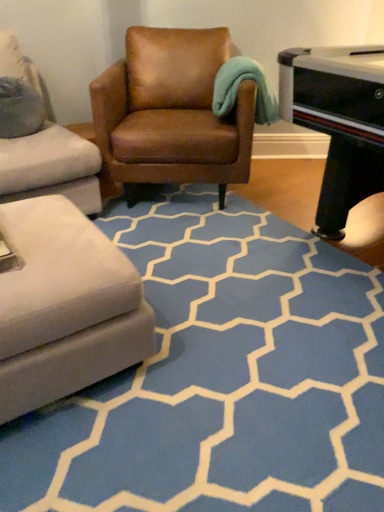
What do you see at coordinates (221, 377) in the screenshot? I see `blue carpet at center` at bounding box center [221, 377].

Where is `blue carpet at center`? blue carpet at center is located at coordinates (221, 377).

Measure the distance between point (177, 329) and camera.

1.50 meters.

Find the location of a particular element. This screenshot has width=384, height=512. brown leather chair at center is located at coordinates (171, 113).

The width and height of the screenshot is (384, 512). What do you see at coordinates (171, 113) in the screenshot? I see `brown leather chair at center` at bounding box center [171, 113].

What is the approximate height of brown leather chair at center?

brown leather chair at center is 33.47 inches in height.

Image resolution: width=384 pixels, height=512 pixels. What are the coordinates of `blue carpet at center` in the screenshot? It's located at (221, 377).

Looking at this image, which object is positioned more to the right, blue carpet at center or brown leather chair at center?

blue carpet at center.

Is the position of blue carpet at center less distant than that of brown leather chair at center?

Yes, blue carpet at center is in front of brown leather chair at center.

Considering the positions of point (136, 461) and point (229, 133), is point (136, 461) closer or farther from the camera than point (229, 133)?

Clearly, point (136, 461) is closer to the camera than point (229, 133).

From the image's perspective, would you say blue carpet at center is positioned over brown leather chair at center?

No, from the image's perspective, blue carpet at center is not on top of brown leather chair at center.

From a real-world perspective, is blue carpet at center below brown leather chair at center?

Yes, from a real-world perspective, blue carpet at center is under brown leather chair at center.

Does blue carpet at center have a greater width compared to brown leather chair at center?

Yes.

Is blue carpet at center taller than brown leather chair at center?

In fact, blue carpet at center may be shorter than brown leather chair at center.

Which of these two, blue carpet at center or brown leather chair at center, is smaller?

Smaller between the two is blue carpet at center.

Do you think blue carpet at center is within brown leather chair at center, or outside of it?

blue carpet at center cannot be found inside brown leather chair at center.

Is the surface of blue carpet at center in direct contact with brown leather chair at center?

No, blue carpet at center is not beside brown leather chair at center.

Consider the image. Is blue carpet at center looking in the opposite direction of brown leather chair at center?

No, blue carpet at center is not facing away from brown leather chair at center.

You are a GUI agent. You are given a task and a screenshot of the screen. Output one action in this format:
    pyautogui.click(x=<x>, y=<y>)
    Task: Click on the chair that is on the left side of blue carpet at center
    
    Given the screenshot: What is the action you would take?
    pyautogui.click(x=171, y=113)

Is brown leather chair at center to the left or to the right of blue carpet at center in the image?

From the image, it's evident that brown leather chair at center is to the left of blue carpet at center.

From the picture: Is the depth of brown leather chair at center less than that of blue carpet at center?

No, the depth of brown leather chair at center is greater than that of blue carpet at center.

Between point (115, 116) and point (44, 423), which one is positioned behind?

The point (115, 116) is farther.

From the image's perspective, between brown leather chair at center and blue carpet at center, which one is located above?

brown leather chair at center.

Consider the image. From a real-world perspective, which object stands above the other?

brown leather chair at center.

Looking at this image, considering the sizes of objects brown leather chair at center and blue carpet at center in the image provided, who is wider, brown leather chair at center or blue carpet at center?

With larger width is blue carpet at center.

Can you confirm if brown leather chair at center is taller than blue carpet at center?

Yes.

Considering the sizes of objects brown leather chair at center and blue carpet at center in the image provided, who is bigger, brown leather chair at center or blue carpet at center?

With larger size is brown leather chair at center.

Is brown leather chair at center not inside blue carpet at center?

Yes, brown leather chair at center is outside of blue carpet at center.

Are brown leather chair at center and blue carpet at center beside each other?

No.

Is brown leather chair at center aimed at blue carpet at center?

Yes, brown leather chair at center faces towards blue carpet at center.

What's the angular difference between brown leather chair at center and blue carpet at center's facing directions?

146 degrees separate the facing orientations of brown leather chair at center and blue carpet at center.

Measure the distance from brown leather chair at center to blue carpet at center.

A distance of 38.20 inches exists between brown leather chair at center and blue carpet at center.

Find the location of `chair above the blue carpet at center (from a real-world perspective)`. chair above the blue carpet at center (from a real-world perspective) is located at coordinates (171, 113).

The width and height of the screenshot is (384, 512). I want to click on chair lying on the left of blue carpet at center, so click(x=171, y=113).

What are the coordinates of `pattern located on the right of brown leather chair at center` in the screenshot? It's located at (221, 377).